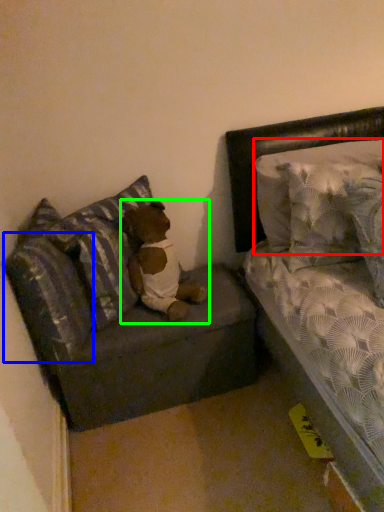
Question: Which is nearer to the pillow (highlighted by a red box)? pillow (highlighted by a blue box) or teddy (highlighted by a green box).

Choices:
 (A) pillow
 (B) teddy

Answer: (B)